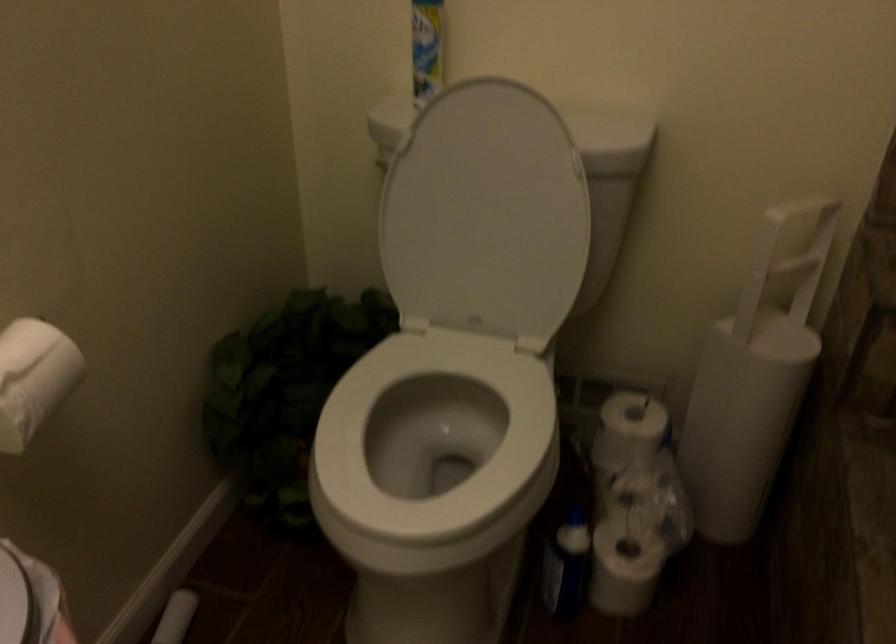
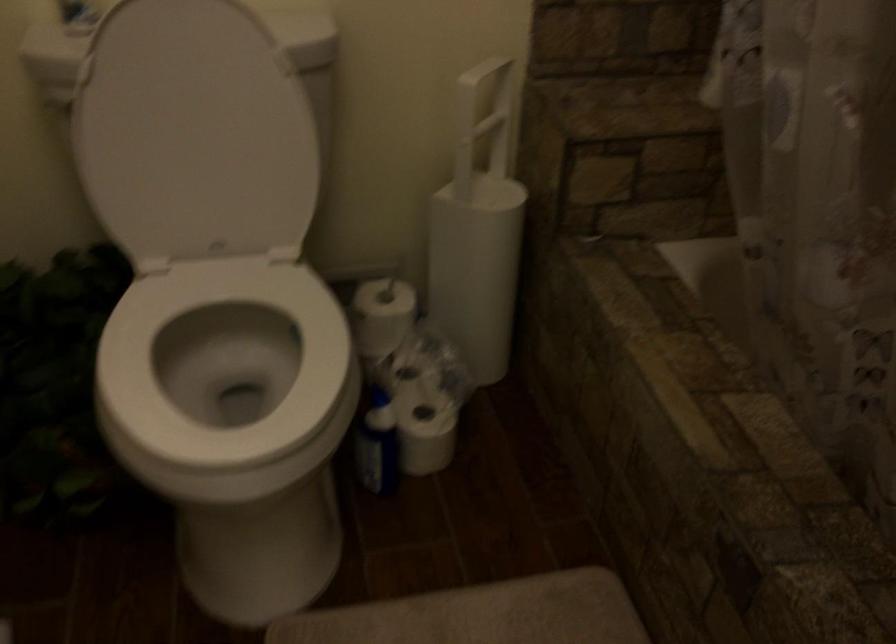
Where in the second image is the point corresponding to (x=471, y=216) from the first image?

(194, 134)